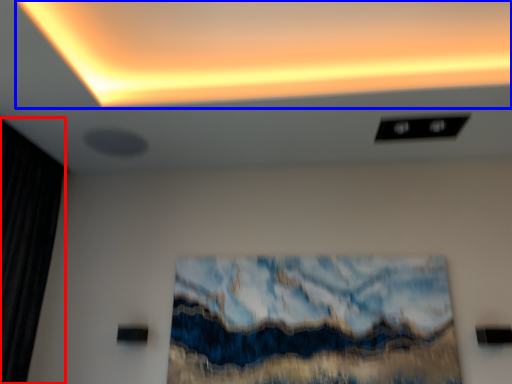
Question: Which object appears farthest to the camera in this image, curtain (highlighted by a red box) or glow (highlighted by a blue box)?

Choices:
 (A) curtain
 (B) glow

Answer: (A)